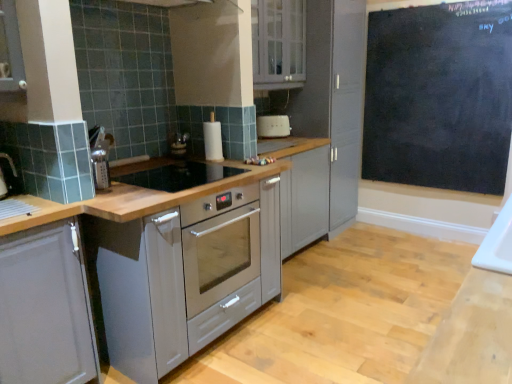
In order to face black chalkboard at upper right, should I rotate leftwards or rightwards?

A 22.519 degree turn to the right will do.

In order to face white plastic toaster at center, should I rotate leftwards or rightwards?

To align with it, rotate right about 2.553°.

What do you see at coordinates (45, 308) in the screenshot?
I see `matte gray cabinet at left, arranged as the first cabinetry when ordered from the bottom` at bounding box center [45, 308].

Measure the distance between white glossy cabinet at upper center, which appears as the 1th cabinetry when viewed from the right, and camera.

white glossy cabinet at upper center, which appears as the 1th cabinetry when viewed from the right, and camera are 2.83 meters apart.

The height and width of the screenshot is (384, 512). Identify the location of black glass gas stove at center. (173, 174).

Image resolution: width=512 pixels, height=384 pixels. What do you see at coordinates (173, 174) in the screenshot? I see `black glass gas stove at center` at bounding box center [173, 174].

In order to click on black chalkboard at upper right in this screenshot , I will do `click(439, 96)`.

Which of these two, matte gray cabinet at left, which ranks as the 2th cabinetry in right-to-left order, or black glass gas stove at center, stands shorter?

black glass gas stove at center is shorter.

Is matte gray cabinet at left, which ranks as the second cabinetry in back-to-front order, spatially inside black glass gas stove at center, or outside of it?

matte gray cabinet at left, which ranks as the second cabinetry in back-to-front order, is not enclosed by black glass gas stove at center.

Is point (5, 244) positioned in front of point (148, 188)?

Yes, it is.

Is there a large distance between matte gray cabinet at left, the first cabinetry positioned from the left, and black glass gas stove at center?

matte gray cabinet at left, the first cabinetry positioned from the left, is actually quite close to black glass gas stove at center.

Considering the relative positions of black glass gas stove at center and matte gray cabinet at left, arranged as the first cabinetry when ordered from the bottom, in the image provided, is black glass gas stove at center in front of matte gray cabinet at left, arranged as the first cabinetry when ordered from the bottom,?

No, the depth of black glass gas stove at center is greater than that of matte gray cabinet at left, arranged as the first cabinetry when ordered from the bottom.

Does point (236, 175) appear closer or farther from the camera than point (17, 327)?

Point (236, 175) is farther from the camera than point (17, 327).

From a real-world perspective, relative to matte gray cabinet at left, the 1th cabinetry in the front-to-back sequence, is black glass gas stove at center vertically above or below?

From a real-world perspective, black glass gas stove at center is physically above matte gray cabinet at left, the 1th cabinetry in the front-to-back sequence.

Looking at their sizes, would you say black glass gas stove at center is wider or thinner than matte gray cabinet at left, the 1th cabinetry in the front-to-back sequence?

Clearly, black glass gas stove at center has more width compared to matte gray cabinet at left, the 1th cabinetry in the front-to-back sequence.

From the image's perspective, does black chalkboard at upper right appear lower than black glass gas stove at center?

Incorrect, from the image's perspective, black chalkboard at upper right is higher than black glass gas stove at center.

At what (x,y) coordinates should I click in order to perform the action: click on bulletin board positioned vertically above the black glass gas stove at center (from a real-world perspective). Please return your answer as a coordinate pair (x, y). The width and height of the screenshot is (512, 384). Looking at the image, I should click on (439, 96).

From a real-world perspective, who is located lower, black chalkboard at upper right or black glass gas stove at center?

From a 3D spatial view, black glass gas stove at center is below.

Between black chalkboard at upper right and black glass gas stove at center, which one has smaller width?

Thinner between the two is black chalkboard at upper right.

Is black chalkboard at upper right taller than white glossy cabinet at upper center, which appears as the 1th cabinetry when viewed from the right?

Yes.

This screenshot has height=384, width=512. Identify the location of cabinetry that is the 1st one when counting forward from the black chalkboard at upper right. (278, 41).

From a real-world perspective, which object rests below the other?

From a 3D spatial view, black chalkboard at upper right is below.

Considering the positions of objects black chalkboard at upper right and white glossy cabinet at upper center, the 2th cabinetry from the bottom, in the image provided, who is in front, black chalkboard at upper right or white glossy cabinet at upper center, the 2th cabinetry from the bottom,?

white glossy cabinet at upper center, the 2th cabinetry from the bottom, is in front.

Which is in front, point (84, 310) or point (262, 130)?

The point (84, 310) is more forward.

Considering the sizes of matte gray cabinet at left, which ranks as the 2th cabinetry in right-to-left order, and white plastic toaster at center in the image, is matte gray cabinet at left, which ranks as the 2th cabinetry in right-to-left order, bigger or smaller than white plastic toaster at center?

matte gray cabinet at left, which ranks as the 2th cabinetry in right-to-left order, is bigger than white plastic toaster at center.

Is matte gray cabinet at left, the 1th cabinetry in the front-to-back sequence, with white plastic toaster at center?

No, matte gray cabinet at left, the 1th cabinetry in the front-to-back sequence, is not with white plastic toaster at center.

Looking at this image, from a real-world perspective, is black chalkboard at upper right physically below matte gray cabinet at left, the 2th cabinetry when ordered from top to bottom?

No, from a real-world perspective, black chalkboard at upper right is not beneath matte gray cabinet at left, the 2th cabinetry when ordered from top to bottom.

Is black chalkboard at upper right thinner than matte gray cabinet at left, which ranks as the second cabinetry in back-to-front order?

Yes.

Can you see black chalkboard at upper right touching matte gray cabinet at left, the first cabinetry positioned from the left?

black chalkboard at upper right and matte gray cabinet at left, the first cabinetry positioned from the left, are clearly separated.

Can you tell me how much black chalkboard at upper right and matte gray cabinet at left, arranged as the first cabinetry when ordered from the bottom, differ in facing direction?

89.8 degrees separate the facing orientations of black chalkboard at upper right and matte gray cabinet at left, arranged as the first cabinetry when ordered from the bottom.

Do you think black glass gas stove at center is within black chalkboard at upper right, or outside of it?

black glass gas stove at center cannot be found inside black chalkboard at upper right.

Between black glass gas stove at center and black chalkboard at upper right, which one has larger size?

black chalkboard at upper right.

From a real-world perspective, is black glass gas stove at center positioned under black chalkboard at upper right based on gravity?

Indeed, from a real-world perspective, black glass gas stove at center is positioned beneath black chalkboard at upper right.

I want to click on gas stove located behind the matte gray cabinet at left, the 1th cabinetry in the front-to-back sequence, so click(x=173, y=174).

At what (x,y) coordinates should I click in order to perform the action: click on cabinetry lying in front of the black glass gas stove at center. Please return your answer as a coordinate pair (x, y). This screenshot has height=384, width=512. Looking at the image, I should click on (45, 308).

Looking at the image, which one is located further to white glossy cabinet at upper center, which is the 1th cabinetry in top-to-bottom order, matte gray cabinet at left, the 1th cabinetry in the front-to-back sequence, or white plastic toaster at center?

The object further to white glossy cabinet at upper center, which is the 1th cabinetry in top-to-bottom order, is matte gray cabinet at left, the 1th cabinetry in the front-to-back sequence.

Considering their positions, is black glass gas stove at center positioned further to white plastic toaster at center than black chalkboard at upper right?

Among the two, black chalkboard at upper right is located further to white plastic toaster at center.

Looking at the image, which one is located further to black glass gas stove at center, white plastic toaster at center or matte gray cabinet at left, which ranks as the second cabinetry in back-to-front order?

Among the two, white plastic toaster at center is located further to black glass gas stove at center.

Looking at the image, which one is located further to white glossy cabinet at upper center, the 2th cabinetry from the bottom, black glass gas stove at center or black chalkboard at upper right?

black glass gas stove at center lies further to white glossy cabinet at upper center, the 2th cabinetry from the bottom, than the other object.

Based on their spatial positions, is black glass gas stove at center or white glossy cabinet at upper center, the second cabinetry positioned from the front, closer to black chalkboard at upper right?

white glossy cabinet at upper center, the second cabinetry positioned from the front, lies closer to black chalkboard at upper right than the other object.

Estimate the real-world distances between objects in this image. Which object is closer to black chalkboard at upper right, white plastic toaster at center or black glass gas stove at center?

Based on the image, white plastic toaster at center appears to be nearer to black chalkboard at upper right.

From the image, which object appears to be nearer to matte gray cabinet at left, arranged as the first cabinetry when ordered from the bottom, black glass gas stove at center or black chalkboard at upper right?

black glass gas stove at center is positioned closer to the anchor matte gray cabinet at left, arranged as the first cabinetry when ordered from the bottom.

Which object lies nearer to the anchor point black glass gas stove at center, black chalkboard at upper right or white glossy cabinet at upper center, which is the 1th cabinetry from back to front?

Among the two, white glossy cabinet at upper center, which is the 1th cabinetry from back to front, is located nearer to black glass gas stove at center.

Locate an element on the screen. This screenshot has height=384, width=512. home appliance between white glossy cabinet at upper center, which is the 1th cabinetry from back to front, and black chalkboard at upper right is located at coordinates (273, 126).

Identify the location of home appliance between black glass gas stove at center and black chalkboard at upper right from left to right. (273, 126).

Where is `gas stove between matte gray cabinet at left, the first cabinetry positioned from the left, and white plastic toaster at center, along the z-axis`? gas stove between matte gray cabinet at left, the first cabinetry positioned from the left, and white plastic toaster at center, along the z-axis is located at coordinates (173, 174).

The height and width of the screenshot is (384, 512). I want to click on cabinetry between matte gray cabinet at left, the 2th cabinetry when ordered from top to bottom, and white plastic toaster at center in the front-back direction, so click(x=278, y=41).